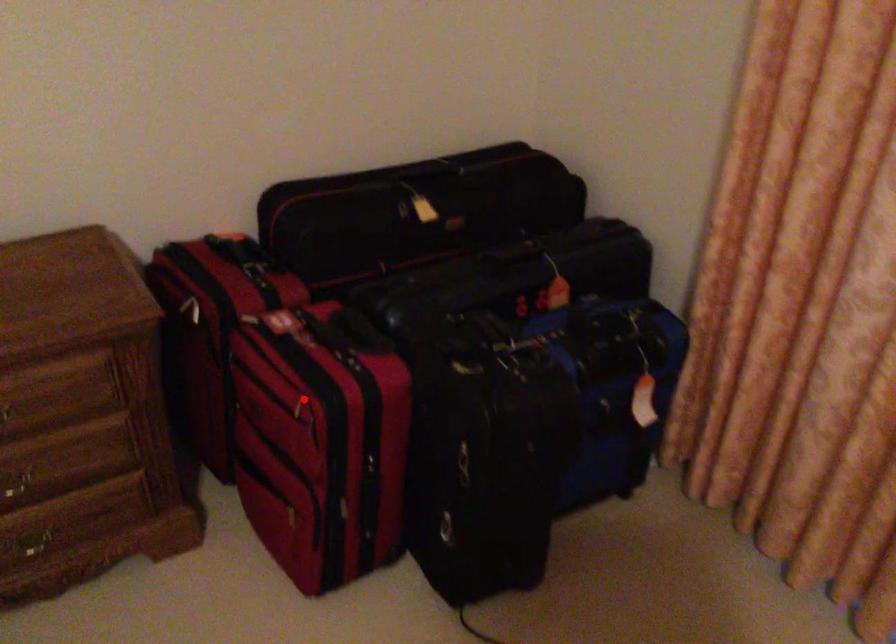
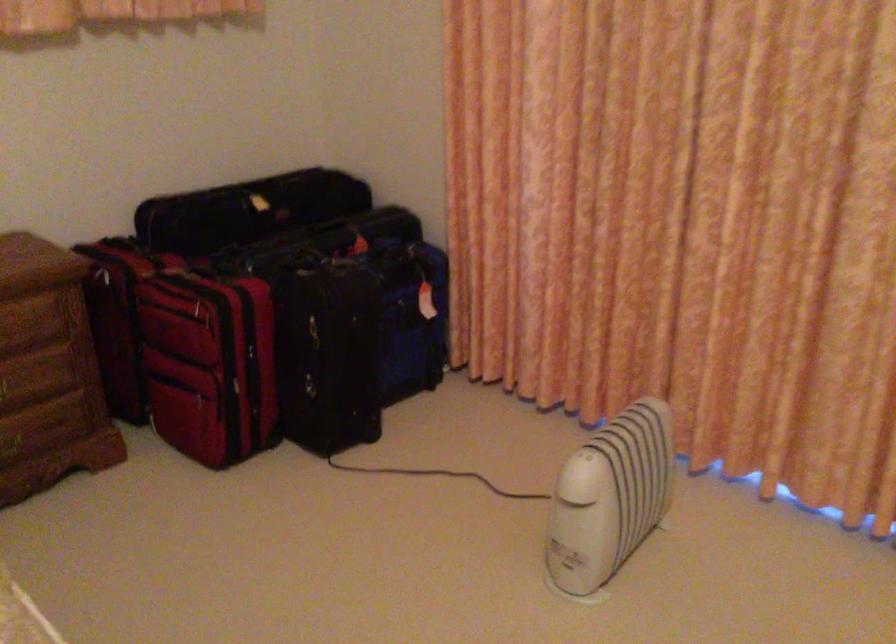
The point at the highlighted location is marked in the first image. Where is the corresponding point in the second image?

(202, 305)